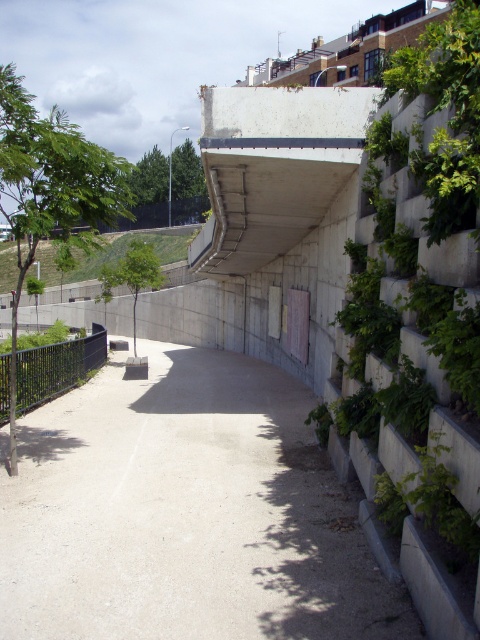
Question: Based on their relative distances, which object is farther from the green leafy tree at center?

Choices:
 (A) white concrete overpass at upper center
 (B) green leafy tree at left

Answer: (B)

Question: Which of the following is the closest to the observer?

Choices:
 (A) green leafy tree at center
 (B) gray concrete path at center
 (C) green leafy tree at left
 (D) white concrete overpass at upper center

Answer: (B)

Question: Does gray concrete path at center have a smaller size compared to green leafy tree at left?

Choices:
 (A) no
 (B) yes

Answer: (B)

Question: Is gray concrete path at center smaller than white concrete overpass at upper center?

Choices:
 (A) yes
 (B) no

Answer: (A)

Question: Is green leafy tree at left closer to camera compared to green leafy tree at center?

Choices:
 (A) yes
 (B) no

Answer: (A)

Question: Which point is farther to the camera?

Choices:
 (A) (144, 256)
 (B) (287, 131)

Answer: (A)